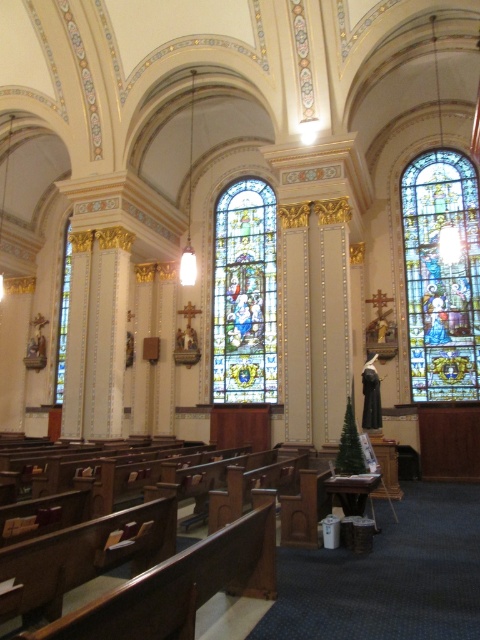
Does point (476, 211) come closer to viewer compared to point (257, 321)?

Yes.

At what (x,y) coordinates should I click in order to perform the action: click on stained glass window at right. Please return your answer as a coordinate pair (x, y). This screenshot has width=480, height=640. Looking at the image, I should click on (442, 275).

Is point (464, 401) farther from camera compared to point (233, 228)?

No, it is in front of (233, 228).

Identify the location of stained glass window at right. (442, 275).

Locate an element on the screen. Image resolution: width=480 pixels, height=640 pixels. stained glass window at right is located at coordinates (442, 275).

Which is above, stained glass window at right or stained glass window at left?

Positioned higher is stained glass window at right.

Where is `stained glass window at right`? The width and height of the screenshot is (480, 640). stained glass window at right is located at coordinates (442, 275).

In order to click on stained glass window at right in this screenshot , I will do `click(442, 275)`.

Which is more to the right, stained glass window at center or stained glass window at left?

Positioned to the right is stained glass window at center.

The width and height of the screenshot is (480, 640). Describe the element at coordinates (244, 294) in the screenshot. I see `stained glass window at center` at that location.

Who is more forward, (239, 321) or (61, 308)?

Point (239, 321) is more forward.

The height and width of the screenshot is (640, 480). Find the location of `stained glass window at center`. stained glass window at center is located at coordinates (244, 294).